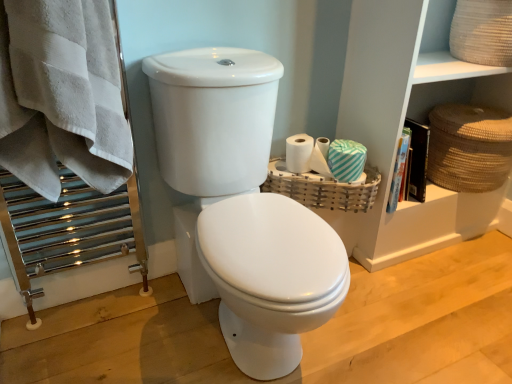
The width and height of the screenshot is (512, 384). Identify the location of vacant area that is situated to the right of white glossy toilet at center. (408, 318).